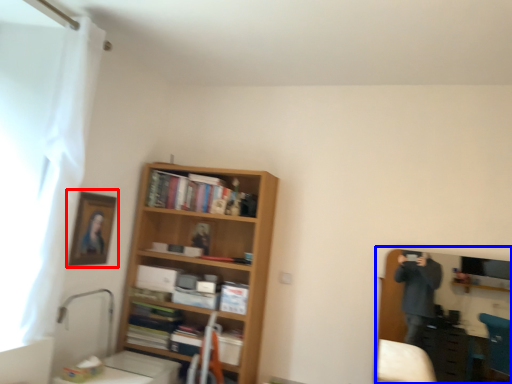
Question: Among these objects, which one is farthest to the camera, picture frame (highlighted by a red box) or entertainment center (highlighted by a blue box)?

Choices:
 (A) picture frame
 (B) entertainment center

Answer: (A)